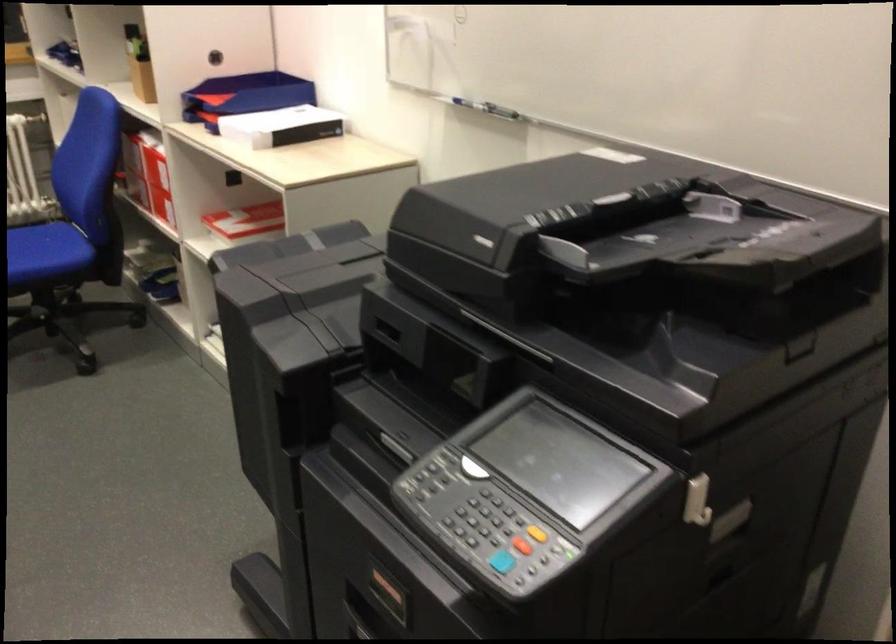
Where would you press the grey printer button? Please return your answer as a coordinate pair (x, y).

(470, 514)